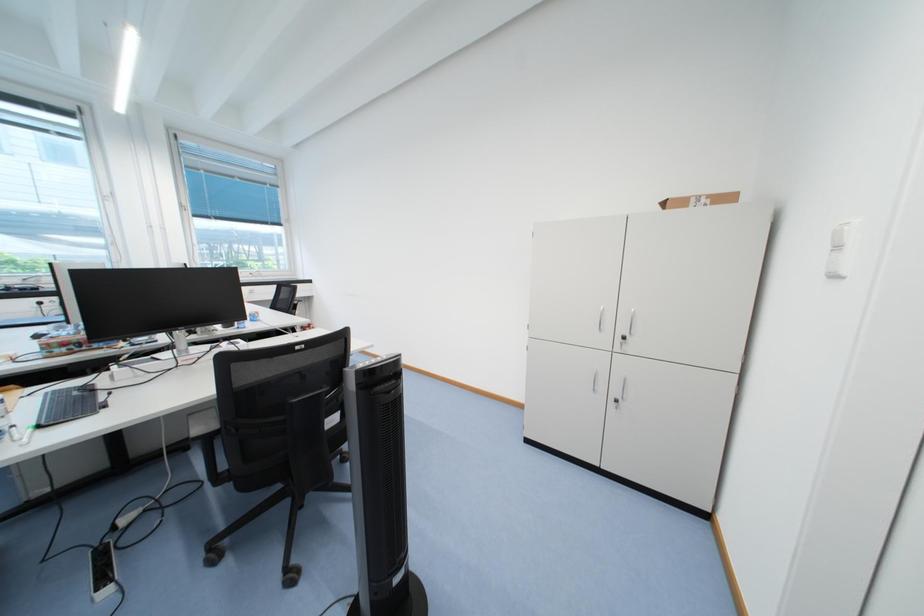
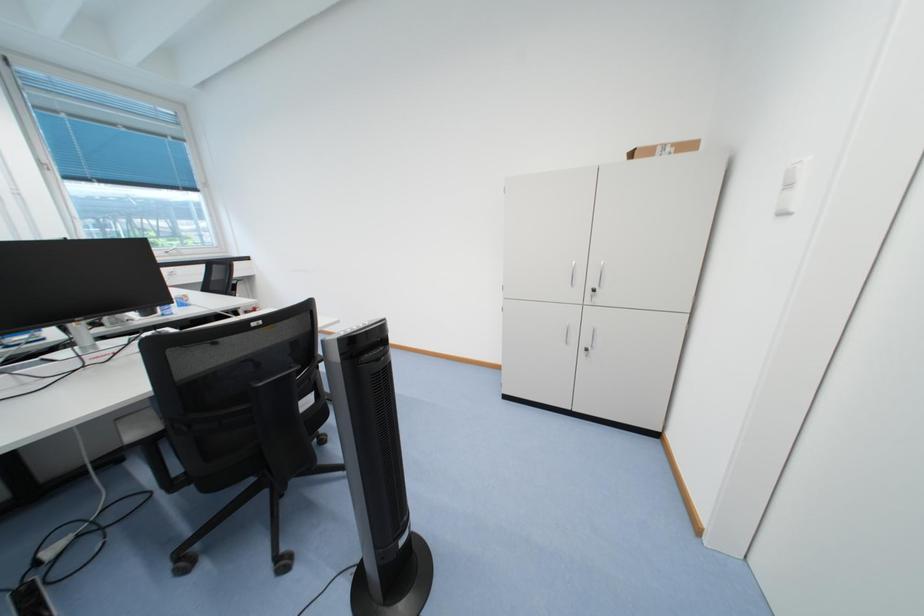
In a continuous first-person perspective shot, in which direction is the camera moving?

The cameraman walked toward left, forward.